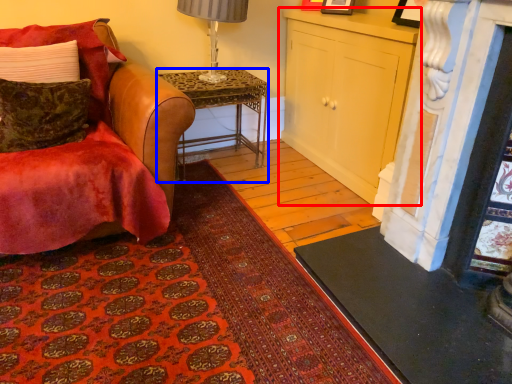
Question: Which object is further to the camera taking this photo, cabinetry (highlighted by a red box) or desk (highlighted by a blue box)?

Choices:
 (A) cabinetry
 (B) desk

Answer: (B)